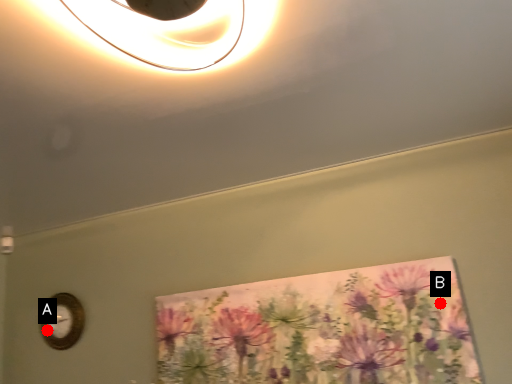
Question: Two points are circled on the image, labeled by A and B beside each circle. Which point appears farthest from the camera in this image?

Choices:
 (A) A is further
 (B) B is further

Answer: (A)